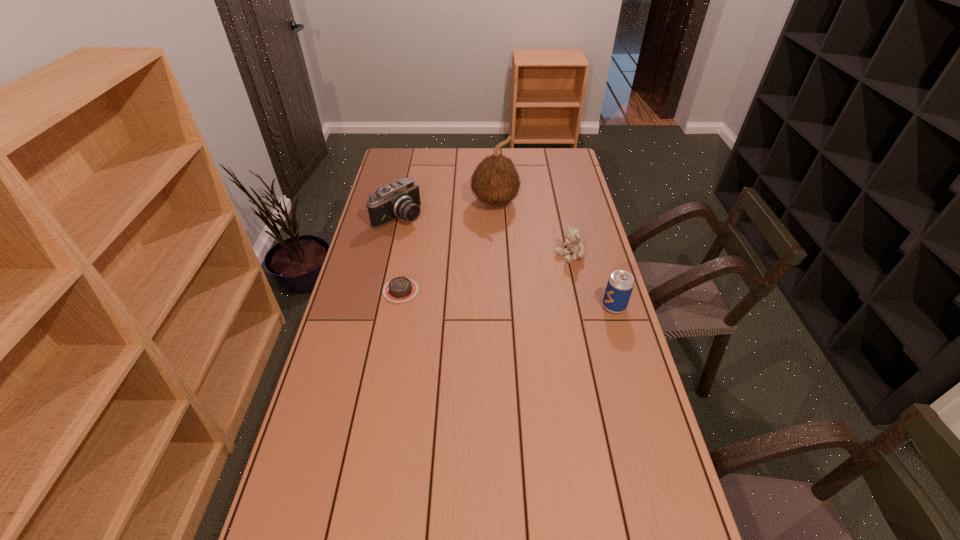
The height and width of the screenshot is (540, 960). What are the coordinates of `free point between the tallest object and the camera` in the screenshot? It's located at (446, 210).

At what (x,y) coordinates should I click in order to perform the action: click on free point between the third object from left to right and the teddy bear. Please return your answer as a coordinate pair (x, y). The image size is (960, 540). Looking at the image, I should click on click(533, 229).

Where is `unoccupied position between the camera and the chocolate cake`? The height and width of the screenshot is (540, 960). unoccupied position between the camera and the chocolate cake is located at coordinates (399, 253).

Where is `free space between the rightmost object and the shortest object`? The height and width of the screenshot is (540, 960). free space between the rightmost object and the shortest object is located at coordinates (508, 299).

Where is `blank region between the chocolate cake and the teddy bear`? blank region between the chocolate cake and the teddy bear is located at coordinates (486, 273).

Locate an element on the screen. Image resolution: width=960 pixels, height=540 pixels. empty space that is in between the camera and the rightmost object is located at coordinates (506, 261).

Where is `unoccupied position between the beer can and the chocolate cake`? The height and width of the screenshot is (540, 960). unoccupied position between the beer can and the chocolate cake is located at coordinates (508, 299).

The width and height of the screenshot is (960, 540). Identify the location of free space between the fourth object from left to right and the shortest object. (486, 273).

Where is `object that is the fourth closest to the tallest object`? This screenshot has height=540, width=960. object that is the fourth closest to the tallest object is located at coordinates pos(620,284).

Locate an element on the screen. Image resolution: width=960 pixels, height=540 pixels. the second closest object to the tallest object is located at coordinates (576, 247).